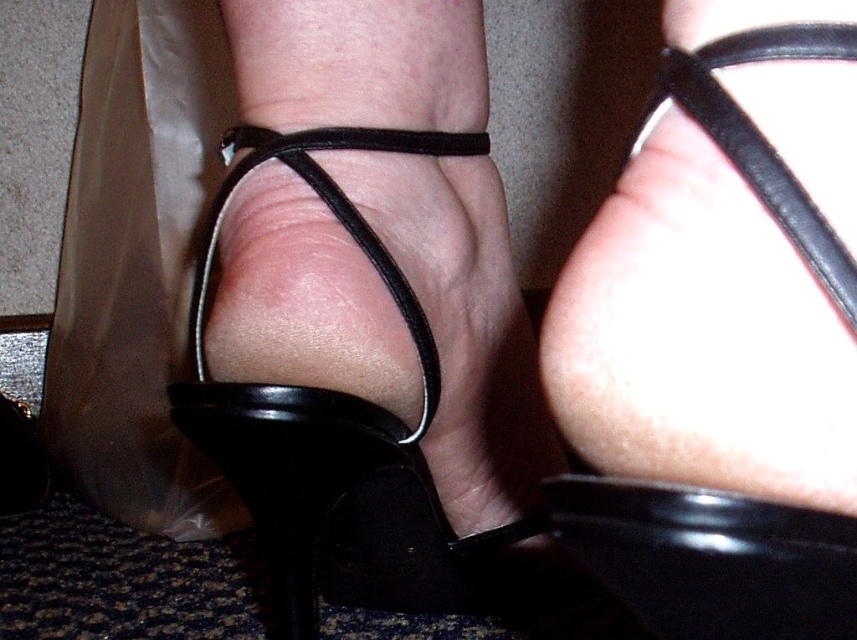
You are standing in a room where two pairs of black sandals are placed on the floor. You see the black suede sandal at center and the black leather sandal at center. Which one is positioned more to the left?

The black suede sandal at center is positioned more to the left than the black leather sandal at center.

You are designing a shoe display stand and need to place both the black leather sandal at center and the black leather strap at upper right on a shelf. The shelf has a width of 10 cm. Can both items fit side by side without overlapping?

The black leather sandal at center is wider than the black leather strap at upper right. If the sandal is wider than 10 cm, they cannot fit side by side. However, if the sandal is less than 10 cm wide, both could fit since the strap is narrower. The exact dimensions are needed to determine.

You are a photographer setting up a shoot and need to position a prop behind the black suede sandal at center and the black leather strap at upper right without it being obscured. Which object should you place the prop behind to ensure it remains visible?

You should place the prop behind the black leather strap at upper right because the black suede sandal at center is closer to the viewer, so placing it behind the black leather strap at upper right would keep it visible.